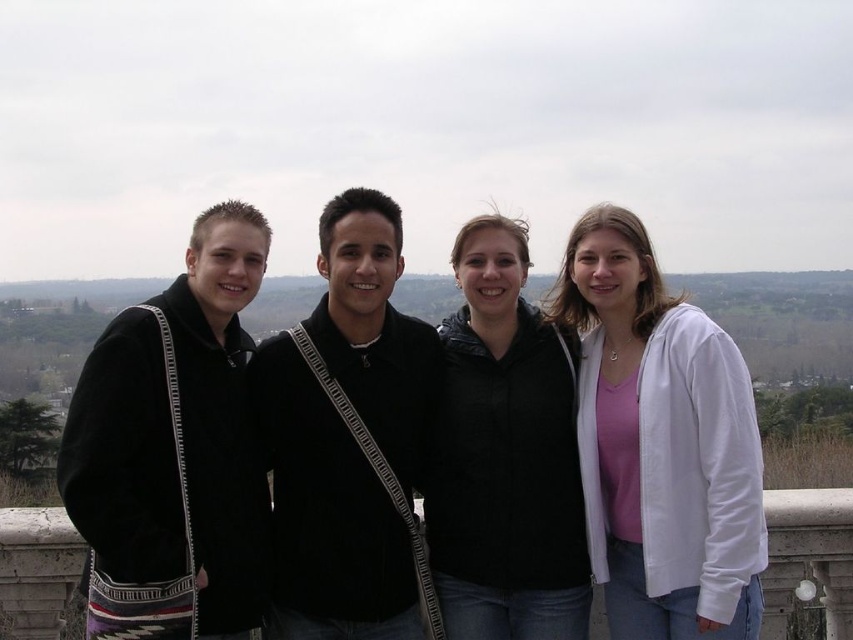
You are a photographer trying to capture a group photo of the white cotton jacket at right and the black jacket at center. The camera you are using has a limited focus range. Can you determine which jacket is wider to ensure proper framing?

The white cotton jacket at right might be wider than black jacket at center, so it should be framed to accommodate its width.

You are standing at the base of the balcony where the four people are standing. You want to toss a small object to the person wearing the white cotton jacket at right. Considering the distance, do you think you can reach them with an average throw?

The white cotton jacket at right is 52.32 feet away from the viewer. An average throw typically has a range of around 30 to 40 feet, so it would be difficult to reach them with a small object using an average throw.

You are a photographer standing behind the group of people. You need to take a photo that includes both the white cotton jacket at right and the black jacket at center. Since you want to ensure both are visible, which direction should you move to frame them properly?

You should move to the left to frame both the white cotton jacket at right and the black jacket at center properly, as the white cotton jacket at right is positioned to the right of the black jacket at center.